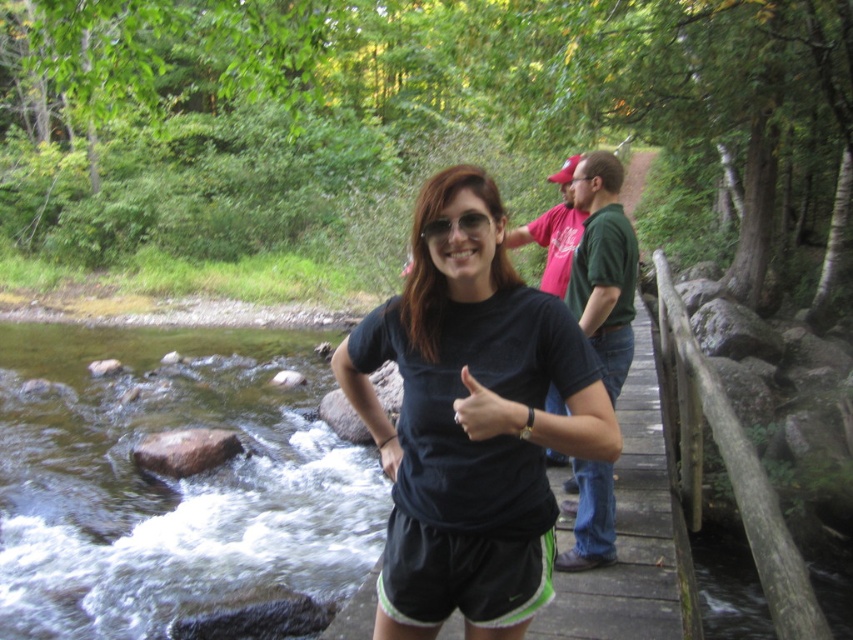
Question: Which object is farther from the camera taking this photo?

Choices:
 (A) matte green shirt at upper right
 (B) black matte t-shirt at center

Answer: (A)

Question: Does black matte t-shirt at center have a lesser width compared to matte green shirt at upper right?

Choices:
 (A) yes
 (B) no

Answer: (B)

Question: Which object appears farthest from the camera in this image?

Choices:
 (A) black fabric shorts at center
 (B) black matte t-shirt at center

Answer: (A)

Question: Does black fabric shorts at center have a larger size compared to matte green shirt at upper right?

Choices:
 (A) yes
 (B) no

Answer: (A)

Question: Is brown smooth water at lower left smaller than black fabric shorts at center?

Choices:
 (A) no
 (B) yes

Answer: (A)

Question: Which of these objects is positioned closest to the green matte shirt at upper right?

Choices:
 (A) black fabric shorts at center
 (B) brown smooth water at lower left

Answer: (A)